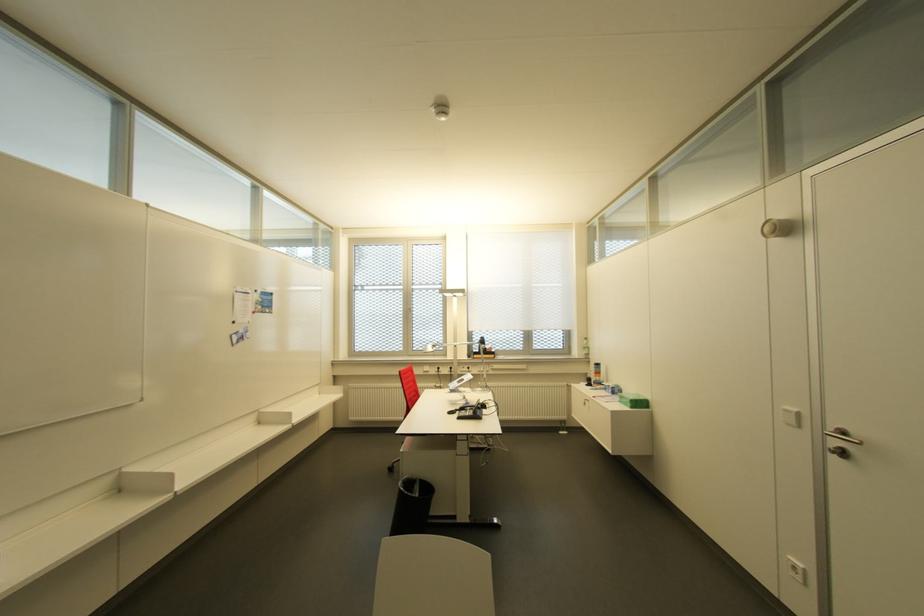
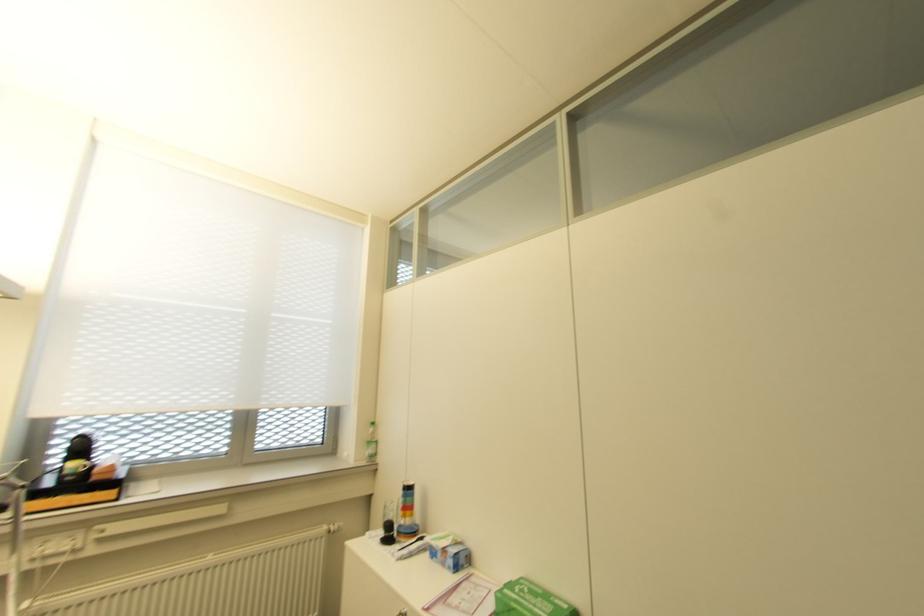
In the second image, find the point that corresponds to pixel 586 355 in the first image.

(372, 455)